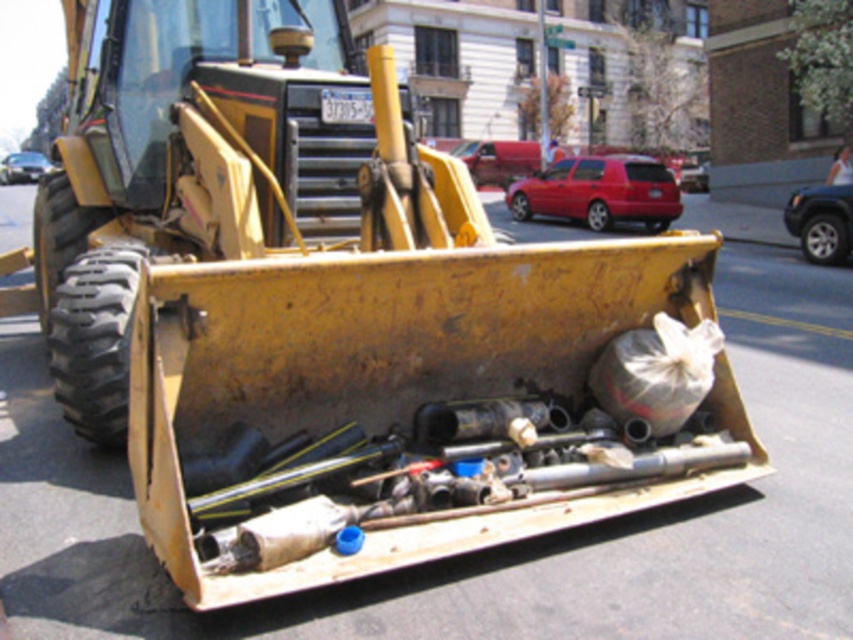
Question: Can you confirm if metallic blue suv at right is positioned to the right of metallic silver car at left?

Choices:
 (A) yes
 (B) no

Answer: (A)

Question: Does matte red car at center have a smaller size compared to metallic silver car at left?

Choices:
 (A) yes
 (B) no

Answer: (A)

Question: Which object is closer to the camera taking this photo?

Choices:
 (A) metallic blue suv at right
 (B) metallic silver car at left
 (C) matte red car at center

Answer: (A)

Question: Can you confirm if matte red car at center is smaller than metallic silver car at left?

Choices:
 (A) yes
 (B) no

Answer: (A)

Question: Which object is farther from the camera taking this photo?

Choices:
 (A) metallic blue suv at right
 (B) matte red car at center
 (C) metallic silver car at left

Answer: (C)

Question: Which of the following is the farthest from the observer?

Choices:
 (A) (33, 154)
 (B) (807, 244)
 (C) (614, 198)

Answer: (A)